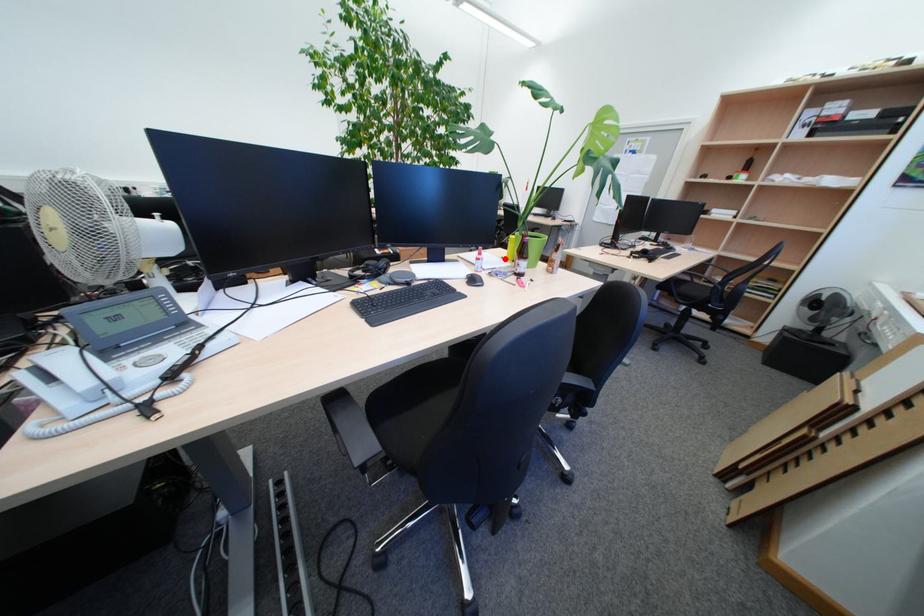
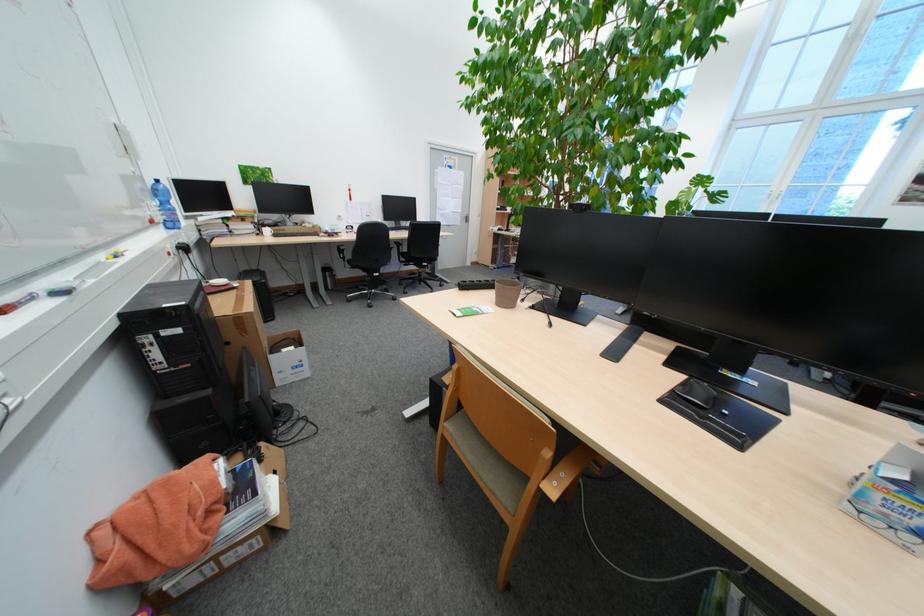
Question: I am providing you with two images of the same scene from different viewpoints. A red point is marked on the first image. Is the red point's position out of view in image 2?

Choices:
 (A) Yes
 (B) No

Answer: (A)